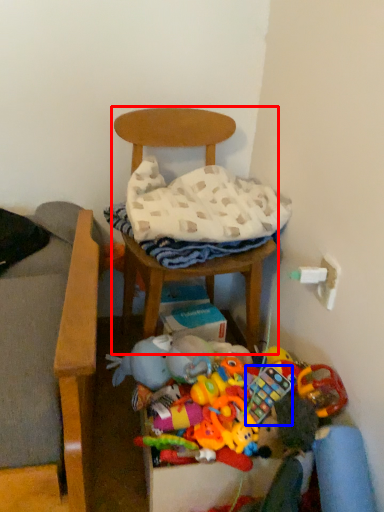
Question: Which object is further to the camera taking this photo, chair (highlighted by a red box) or toy (highlighted by a blue box)?

Choices:
 (A) chair
 (B) toy

Answer: (A)